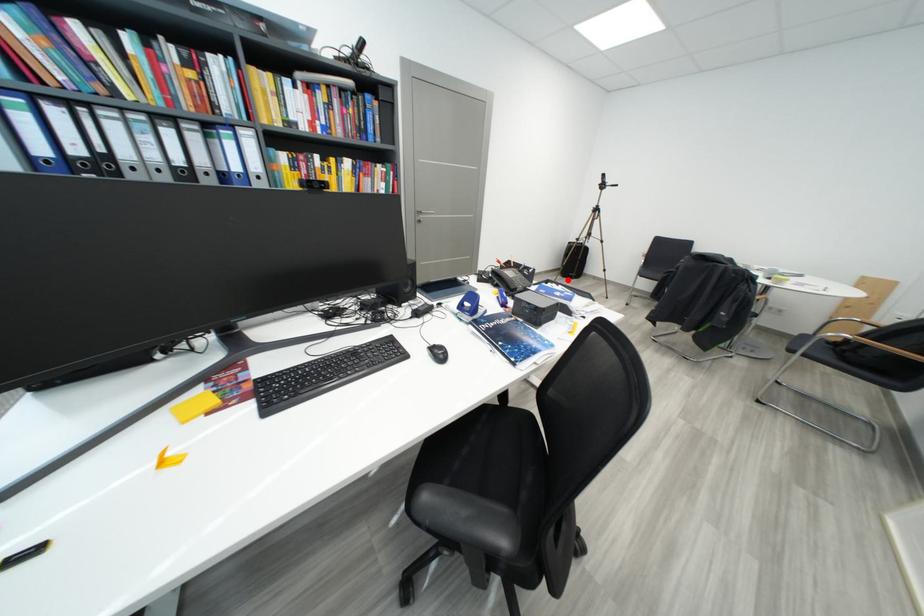
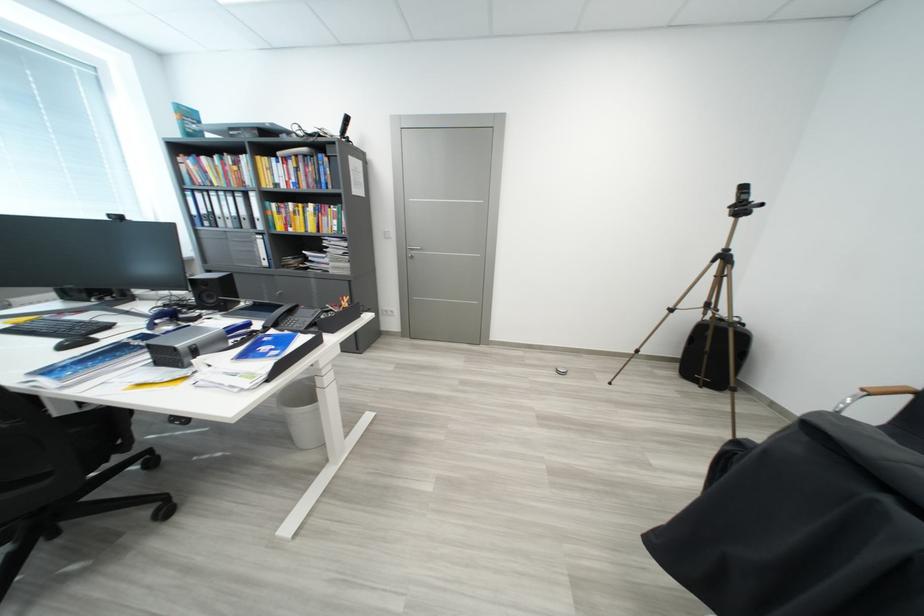
Question: I am providing you with two images of the same scene from different viewpoints. Given a red point in image1, look at the same physical point in image2. Is it:

Choices:
 (A) Closer to the viewpoint
 (B) Farther from the viewpoint

Answer: (A)